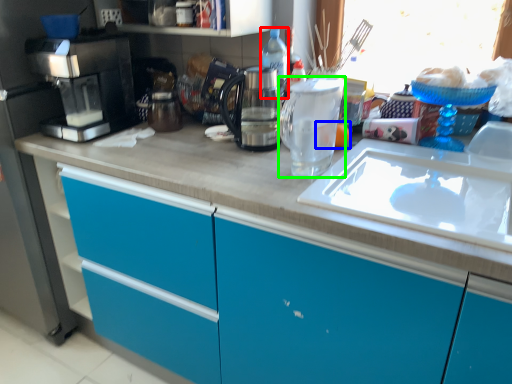
Question: Which object is the farthest from bottle (highlighted by a red box)? Choose among these: food (highlighted by a blue box) or kitchen appliance (highlighted by a green box).

Choices:
 (A) food
 (B) kitchen appliance

Answer: (A)